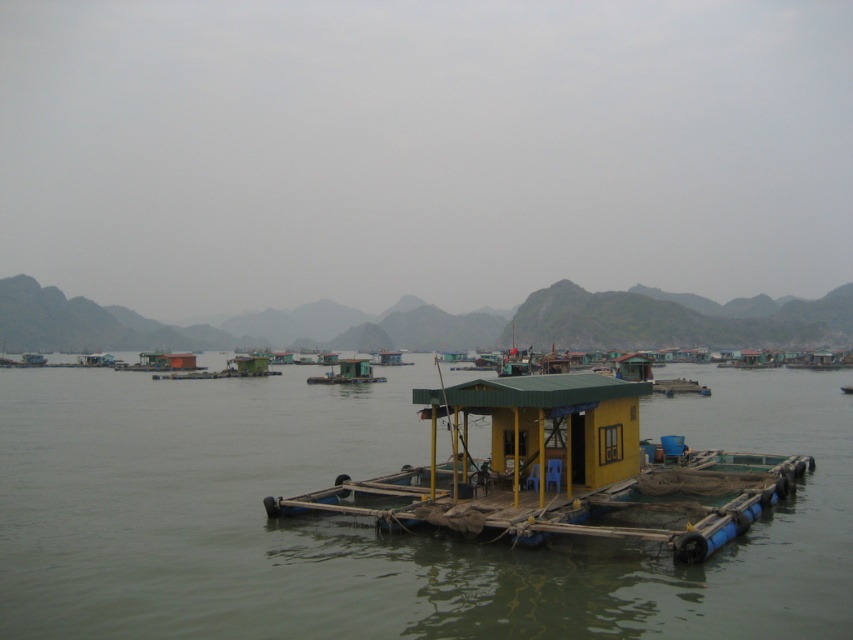
You are a visitor planning to rent a houseboat in this area. You want to choose the taller one between the yellow matte houseboat at center and the green matte houseboat at center. Which one should you choose?

The yellow matte houseboat at center is much taller than the green matte houseboat at center, so you should choose the yellow matte houseboat at center.